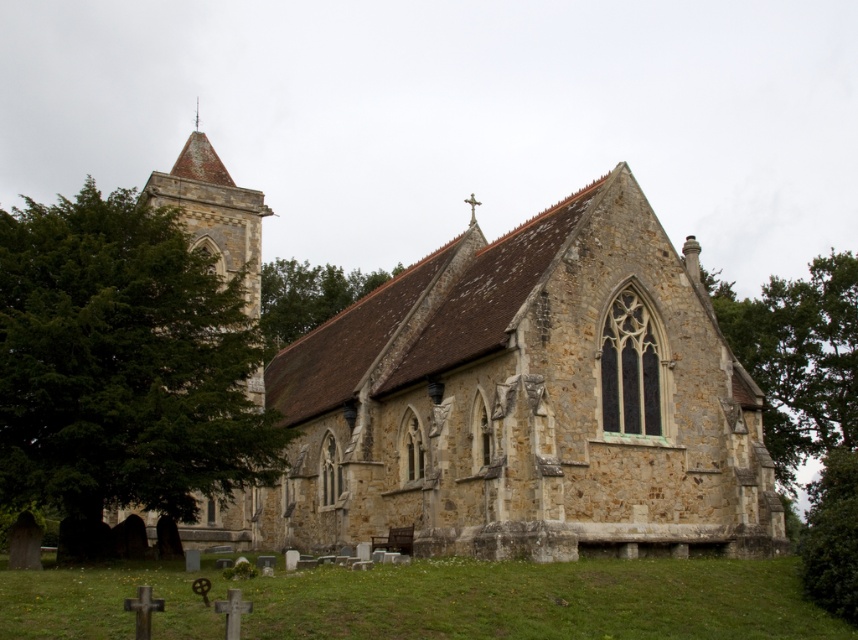
Question: Can you confirm if stone church at center is positioned below green grass at lower center?

Choices:
 (A) no
 (B) yes

Answer: (A)

Question: Which of the following is the farthest from the observer?

Choices:
 (A) green leafy tree at center
 (B) green leafy tree at lower right
 (C) stone church at center
 (D) green grass at lower center

Answer: (A)

Question: Is green grass at lower center bigger than green leafy tree at center?

Choices:
 (A) yes
 (B) no

Answer: (B)

Question: Estimate the real-world distances between objects in this image. Which object is farther from the green leafy tree at left?

Choices:
 (A) stone church at center
 (B) green leafy tree at lower right
 (C) green leafy tree at center

Answer: (B)

Question: Which of these objects is positioned farthest from the green grass at lower center?

Choices:
 (A) green leafy tree at center
 (B) green leafy tree at upper right
 (C) green leafy tree at left

Answer: (A)

Question: Does green grass at lower center have a lesser width compared to green leafy tree at lower right?

Choices:
 (A) no
 (B) yes

Answer: (B)